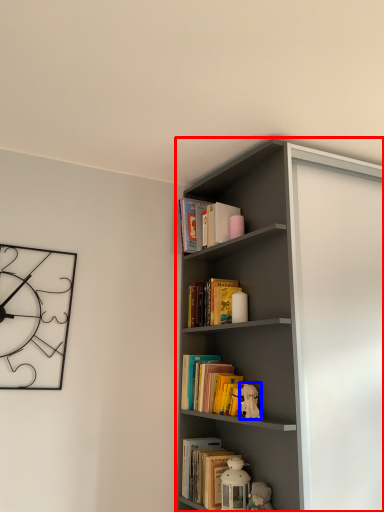
Question: Which of the following is the closest to the observer, shelf (highlighted by a red box) or toy (highlighted by a blue box)?

Choices:
 (A) shelf
 (B) toy

Answer: (A)